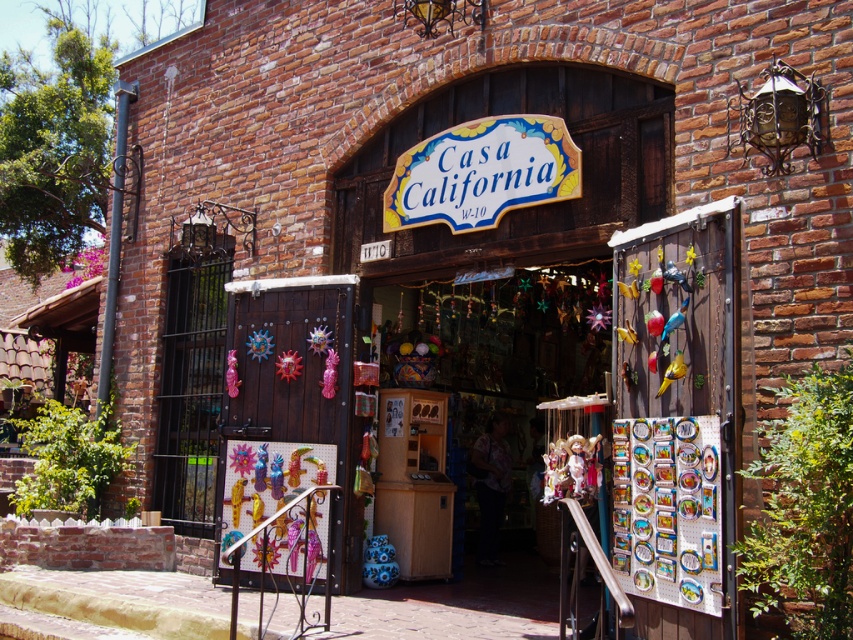
You are a painter who needs to know which object requires more vertical space to paint. Based on the scene, which object is taller between the metallic painted door at center and the white painted wood sign at center?

The metallic painted door at center is much taller than the white painted wood sign at center, so the metallic painted door at center requires more vertical space to paint.